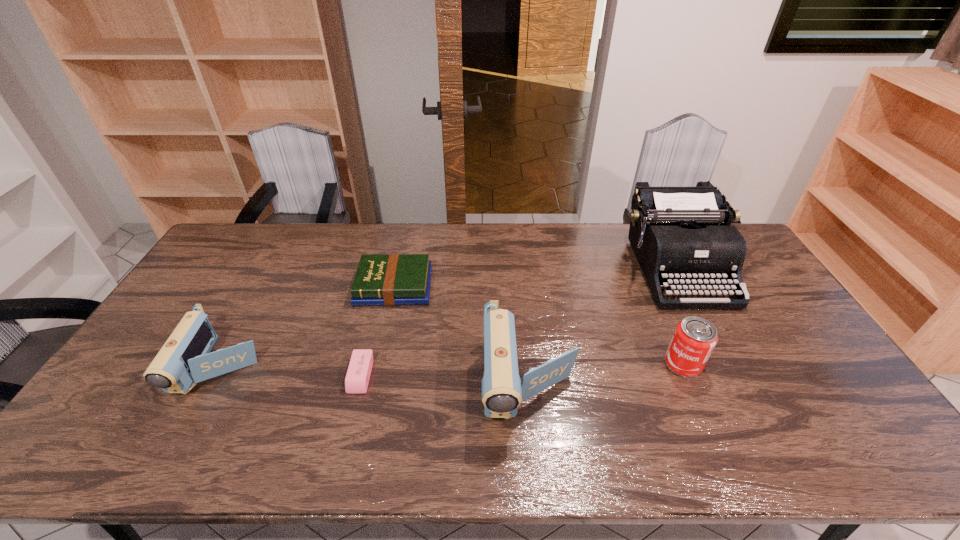
Find the location of a particular element. This screenshot has width=960, height=540. vacant area that lies between the taller camcorder and the leftmost object is located at coordinates point(375,376).

This screenshot has height=540, width=960. Find the location of `the fifth closest object to the book`. the fifth closest object to the book is located at coordinates (694, 339).

Where is `object that is the second closest to the typewriter`? The height and width of the screenshot is (540, 960). object that is the second closest to the typewriter is located at coordinates (502, 390).

At what (x,y) coordinates should I click in order to perform the action: click on vacant region that satisfies the following two spatial constraints: 1. on the back side of the can; 2. on the left side of the eraser. Please return your answer as a coordinate pair (x, y). Looking at the image, I should click on (364, 364).